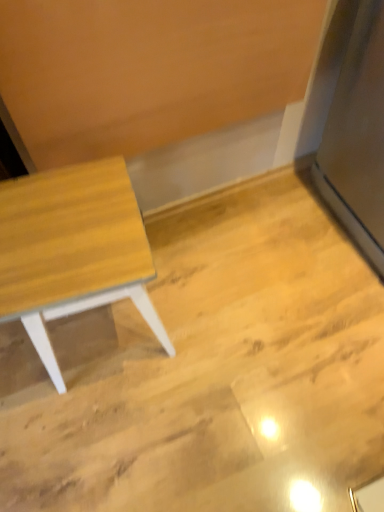
Question: Is light wood table at left behind satin silver fridge at right?

Choices:
 (A) no
 (B) yes

Answer: (B)

Question: Is light wood table at left facing away from satin silver fridge at right?

Choices:
 (A) no
 (B) yes

Answer: (A)

Question: Is light wood table at left with satin silver fridge at right?

Choices:
 (A) no
 (B) yes

Answer: (A)

Question: Can you confirm if light wood table at left is bigger than satin silver fridge at right?

Choices:
 (A) no
 (B) yes

Answer: (A)

Question: Could you tell me if light wood table at left is facing satin silver fridge at right?

Choices:
 (A) no
 (B) yes

Answer: (A)

Question: Is light wood table at left outside of satin silver fridge at right?

Choices:
 (A) yes
 (B) no

Answer: (A)

Question: Is the depth of satin silver fridge at right greater than that of light wood table at left?

Choices:
 (A) yes
 (B) no

Answer: (B)

Question: Considering the relative positions of satin silver fridge at right and light wood table at left in the image provided, is satin silver fridge at right to the left of light wood table at left from the viewer's perspective?

Choices:
 (A) no
 (B) yes

Answer: (A)

Question: Does satin silver fridge at right have a lesser height compared to light wood table at left?

Choices:
 (A) yes
 (B) no

Answer: (B)

Question: Can you confirm if satin silver fridge at right is taller than light wood table at left?

Choices:
 (A) no
 (B) yes

Answer: (B)

Question: Is satin silver fridge at right looking in the opposite direction of light wood table at left?

Choices:
 (A) no
 (B) yes

Answer: (A)

Question: Is satin silver fridge at right completely or partially outside of light wood table at left?

Choices:
 (A) no
 (B) yes

Answer: (B)

Question: Considering the positions of satin silver fridge at right and light wood table at left in the image, is satin silver fridge at right bigger or smaller than light wood table at left?

Choices:
 (A) small
 (B) big

Answer: (B)